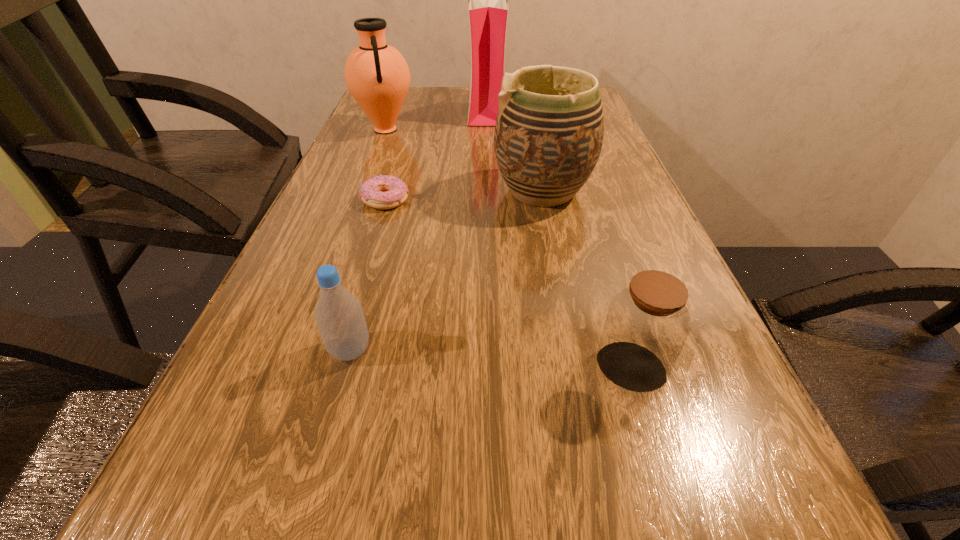
Identify the location of shopping bag. (488, 9).

Identify the location of pitcher. The image size is (960, 540). (376, 74).

Locate an element on the screen. pottery is located at coordinates (549, 131).

At what (x,y) coordinates should I click in order to perform the action: click on bottle. Please return your answer as a coordinate pair (x, y). The height and width of the screenshot is (540, 960). Looking at the image, I should click on (339, 316).

Identify the location of jar. Image resolution: width=960 pixels, height=540 pixels. (647, 324).

Locate an element on the screen. The image size is (960, 540). doughnut is located at coordinates (382, 192).

Locate an element on the screen. This screenshot has width=960, height=540. vacant point located on the front-facing side of the shopping bag is located at coordinates (431, 109).

I want to click on free point located on the front-facing side of the shopping bag, so click(366, 109).

Locate an element on the screen. The width and height of the screenshot is (960, 540). vacant region located on the front-facing side of the shopping bag is located at coordinates (390, 109).

Where is `vacant region located on the right of the pitcher`? vacant region located on the right of the pitcher is located at coordinates (439, 130).